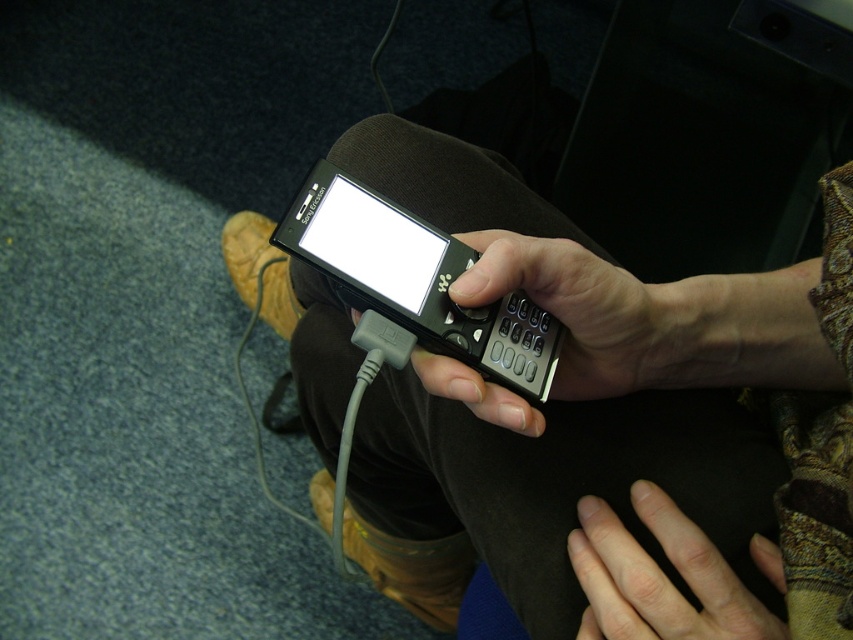
Is point (540, 284) positioned after point (440, 241)?

No, it is in front of (440, 241).

Who is positioned more to the right, black matte keypad at center or bright glossy screen at center?

Positioned to the right is black matte keypad at center.

Who is more distant from viewer, [532,408] or [387,250]?

The point [532,408] is behind.

Image resolution: width=853 pixels, height=640 pixels. I want to click on black matte keypad at center, so click(573, 308).

From the picture: Which of these two, black matte phone at center or black plastic smartphone at center, stands taller?

Standing taller between the two is black matte phone at center.

This screenshot has height=640, width=853. In order to click on black matte phone at center in this screenshot , I will do `click(608, 420)`.

Does black plastic smartphone at center have a greater width compared to smooth skin hand at lower center?

Indeed, black plastic smartphone at center has a greater width compared to smooth skin hand at lower center.

Is black plastic smartphone at center above smooth skin hand at lower center?

Yes.

The image size is (853, 640). In order to click on black plastic smartphone at center in this screenshot , I will do `click(415, 280)`.

This screenshot has height=640, width=853. I want to click on black plastic smartphone at center, so click(x=415, y=280).